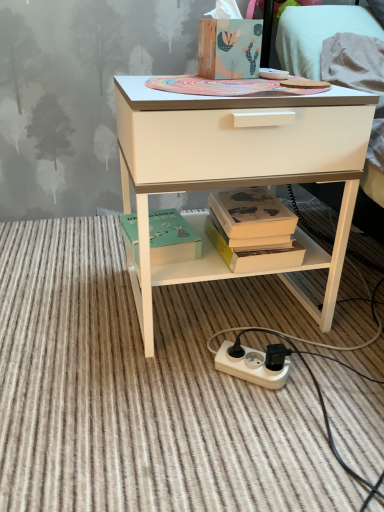
Find the location of a particular element. Image resolution: width=384 pixels, height=512 pixels. free space behind white plastic power outlet at lower center is located at coordinates (241, 322).